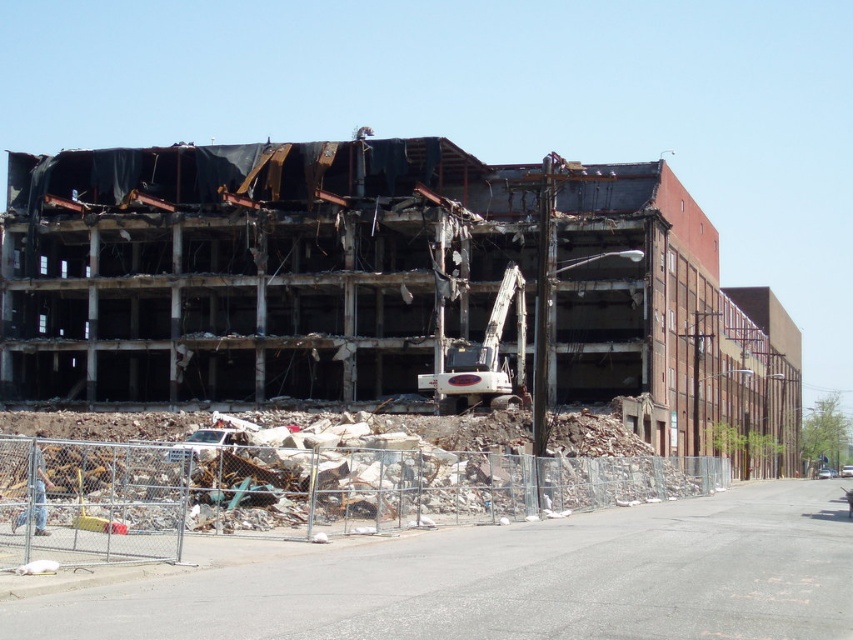
You are a construction worker operating the white metallic excavator at center. You need to move the debris pile located to the left of the rusty metal building at center. Which direction should you move the excavator to reach the debris pile?

The rusty metal building at center is to the right of the white metallic excavator at center, so to reach the debris pile to the left of the rusty metal building at center, you should move the excavator to the left.

You are a construction worker standing at the edge of the debris pile. You need to operate the white metallic excavator at center to safely demolish the remaining parts of the rusty metal building at center. Considering their sizes, which object should you target first to prevent collapse on the excavator?

The rusty metal building at center is much taller than the white metallic excavator at center. To prevent collapse, you should target the upper remaining parts of the rusty metal building at center first before they fall onto the excavator.